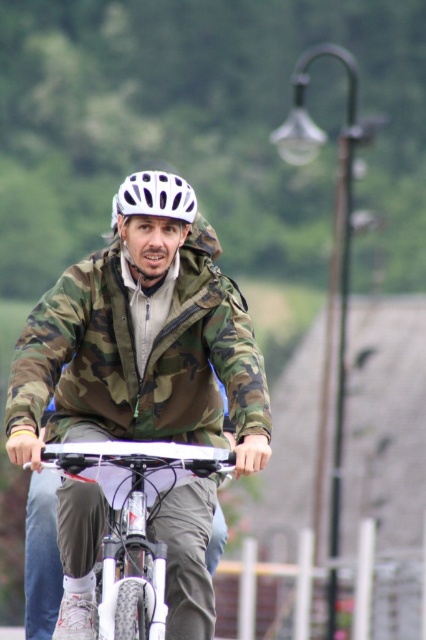
You are a photographer trying to capture a clear shot of the white matte bicycle at center and the white matte helmet at center. Since both are white, you want to ensure you can distinguish them in your photo. Based on their positions, which one should appear larger in your photo?

The white matte bicycle at center should appear larger in the photo because it is closer to the viewer than the white matte helmet at center.

You are a delivery person who needs to carry a 4 meter long ladder on your bicycle. The ladder can only be attached between the camo fabric jacket at center and the white matte helmet at center. Will the ladder fit between these two points?

The distance between the camo fabric jacket at center and the white matte helmet at center is 3.99 meters. Since the ladder is 4 meters long, it will not fit between these two points as the available space is slightly shorter than the ladder.

You are standing at the starting point and want to reach the point marked as point [259,426]. If your maximum walking distance is 50 feet, can you reach it without exceeding your limit?

The point [259,426] is 55.11 feet away from the viewer, which exceeds your maximum walking distance of 50 feet. Therefore, you cannot reach it without exceeding your limit.